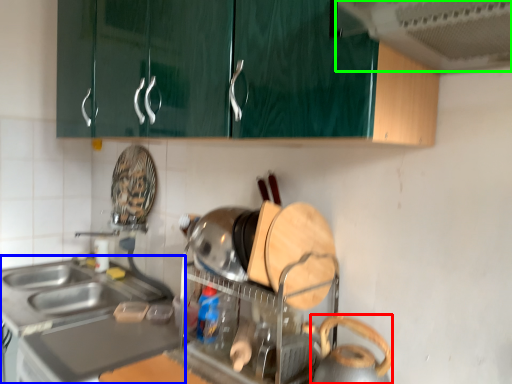
Question: Which object is the farthest from appliance (highlighted by a red box)? Choose among these: countertop (highlighted by a blue box) or exhaust hood (highlighted by a green box).

Choices:
 (A) countertop
 (B) exhaust hood

Answer: (A)